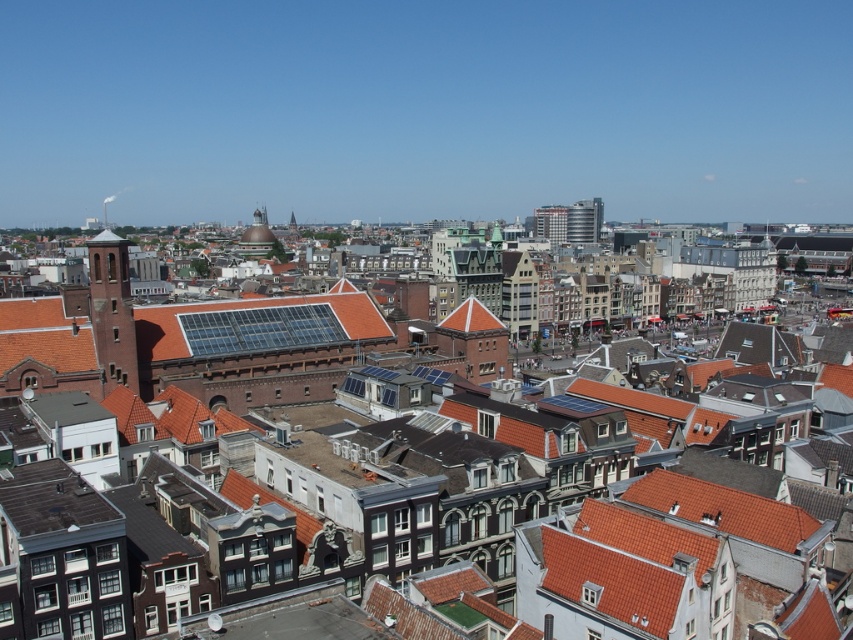
You are standing in the middle of the urban area shown in the image. There are two points of interest marked as point 1 at coordinate (514, 508) and point 2 at coordinate (183, 352). Which point is closer to you?

Point 1 at coordinate (514, 508) is closer to you than point 2 at coordinate (183, 352).

You are a city planner assessing the historical district. You need to determine which of the two structures, the brown tiled roof at center or the dark brown stone tower at left, requires more space for maintenance access. Based on their sizes, which one would need a larger maintenance area?

The brown tiled roof at center is bigger than the dark brown stone tower at left, so it would require a larger maintenance area.

You are a drone operator tasked with capturing aerial footage of the historic buildings in this city. Your drone has a maximum flight range of 150 meters. There is a specific point marked at coordinates point (285,298) that you need to reach. Can your drone safely reach this point without exceeding its range?

The point (285,298) is 156.72 meters away from the camera, which exceeds the drone operator s maximum flight range of 150 meters. Therefore, the drone cannot safely reach this point without exceeding its range.